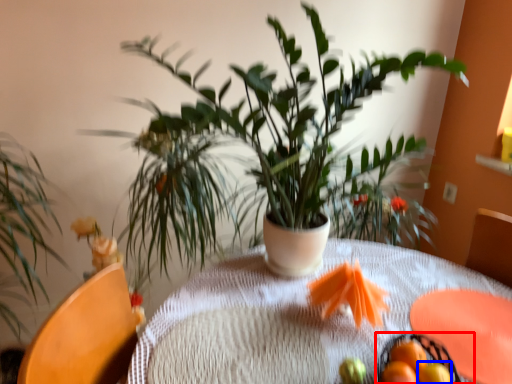
Question: Which point is closer to the camera, basket (highlighted by a red box) or tangerine (highlighted by a blue box)?

Choices:
 (A) basket
 (B) tangerine

Answer: (A)